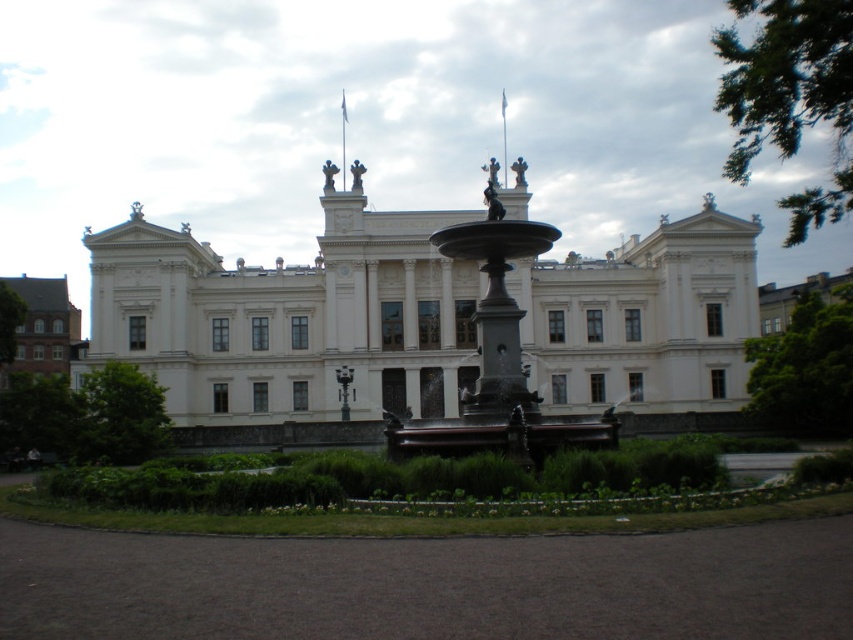
Question: Is white stone building at center thinner than black polished stone fountain at center?

Choices:
 (A) yes
 (B) no

Answer: (B)

Question: Does green leafy garden at center have a larger size compared to black polished stone fountain at center?

Choices:
 (A) yes
 (B) no

Answer: (B)

Question: Which object appears farthest from the camera in this image?

Choices:
 (A) black polished stone fountain at center
 (B) green leafy garden at center

Answer: (A)

Question: Estimate the real-world distances between objects in this image. Which object is farther from the white stone building at center?

Choices:
 (A) black polished stone fountain at center
 (B) green leafy garden at center

Answer: (B)

Question: From the image, what is the correct spatial relationship of white stone building at center in relation to green leafy garden at center?

Choices:
 (A) below
 (B) above

Answer: (B)

Question: Among these objects, which one is nearest to the camera?

Choices:
 (A) black polished stone fountain at center
 (B) green leafy garden at center
 (C) white stone building at center

Answer: (B)